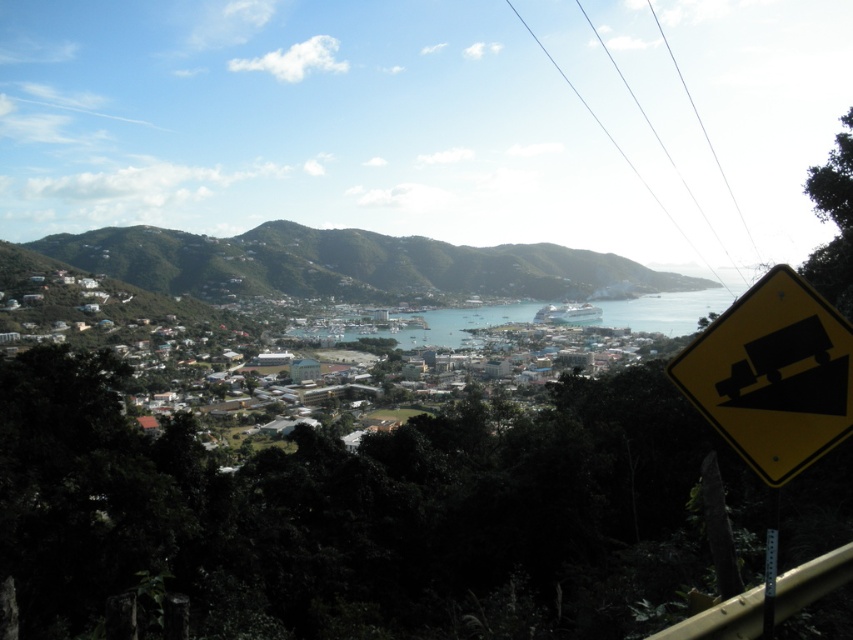
Can you confirm if green grassy hillside at upper left is smaller than yellow plastic sign at lower right?

No.

The image size is (853, 640). Describe the element at coordinates (351, 264) in the screenshot. I see `green grassy hillside at upper left` at that location.

Locate an element on the screen. green grassy hillside at upper left is located at coordinates (351, 264).

Between point (712, 364) and point (721, 301), which one is positioned in front?

Point (712, 364) is more forward.

Is yellow plastic sign at lower right to the right of blue water at center from the viewer's perspective?

In fact, yellow plastic sign at lower right is to the left of blue water at center.

At what (x,y) coordinates should I click in order to perform the action: click on yellow plastic sign at lower right. Please return your answer as a coordinate pair (x, y). The width and height of the screenshot is (853, 640). Looking at the image, I should click on (773, 376).

From the picture: Is the position of green grassy hillside at upper left more distant than that of blue water at center?

That is True.

Measure the distance from green grassy hillside at upper left to blue water at center.

green grassy hillside at upper left and blue water at center are 88.39 meters apart from each other.

The image size is (853, 640). Find the location of `green grassy hillside at upper left`. green grassy hillside at upper left is located at coordinates (351, 264).